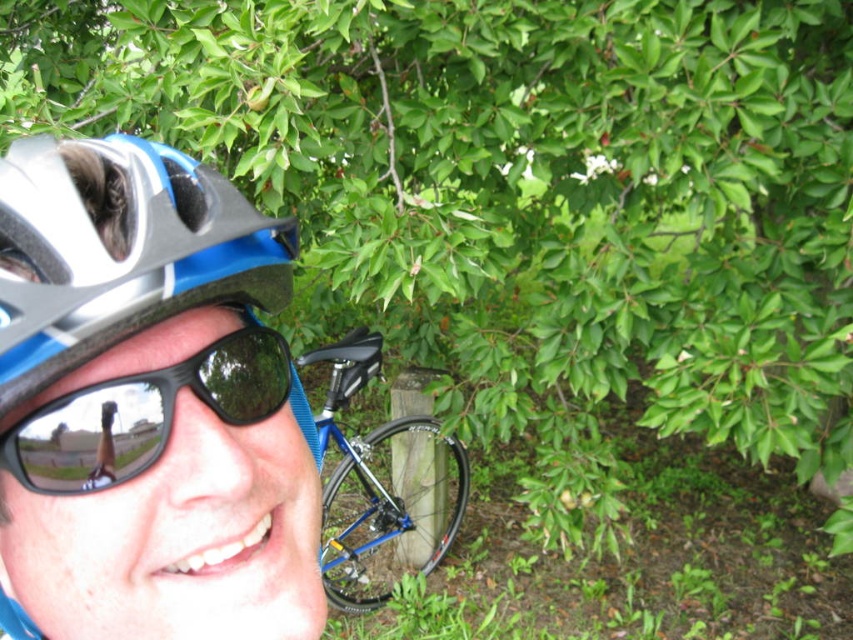
Question: Is the position of matte blue helmet at left less distant than that of black reflective sunglasses at lower left?

Choices:
 (A) yes
 (B) no

Answer: (A)

Question: Is matte blue helmet at left to the right of blue metallic bicycle at center from the viewer's perspective?

Choices:
 (A) no
 (B) yes

Answer: (B)

Question: Among these points, which one is farthest from the camera?

Choices:
 (A) (102, 440)
 (B) (383, 467)
 (C) (47, 243)

Answer: (B)

Question: Which object appears closest to the camera in this image?

Choices:
 (A) matte blue helmet at left
 (B) blue metallic bicycle at center
 (C) black reflective sunglasses at lower left

Answer: (A)

Question: Which object is the closest to the matte blue helmet at left?

Choices:
 (A) blue metallic bicycle at center
 (B) black reflective sunglasses at lower left

Answer: (B)

Question: Considering the relative positions of matte blue helmet at left and blue metallic bicycle at center in the image provided, where is matte blue helmet at left located with respect to blue metallic bicycle at center?

Choices:
 (A) above
 (B) below

Answer: (A)